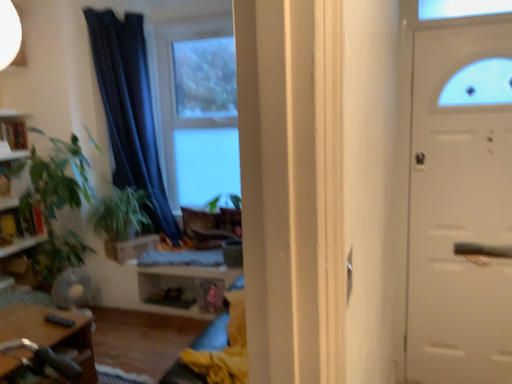
What is the approximate height of dark blue fabric curtain at center?

2.13 meters.

Locate an element on the screen. This screenshot has height=384, width=512. wooden table at lower left is located at coordinates (52, 334).

Locate an element on the screen. This screenshot has height=384, width=512. clear glass window at center is located at coordinates (197, 112).

Where is `wooden bookshelf at left`? wooden bookshelf at left is located at coordinates pyautogui.click(x=12, y=135).

What is the approximate width of wooden bookshelf at left?

9.69 inches.

Identify the location of dark blue fabric curtain at center. This screenshot has width=512, height=384. (130, 110).

From the image's perspective, is clear glass window at center located above or below dark blue fabric curtain at center?

clear glass window at center is situated higher than dark blue fabric curtain at center in the image.

Does clear glass window at center have a smaller size compared to dark blue fabric curtain at center?

Indeed, clear glass window at center has a smaller size compared to dark blue fabric curtain at center.

This screenshot has width=512, height=384. What are the coordinates of `drawer behind the wooden table at lower left` in the screenshot? It's located at (130, 247).

Consider the image. Is brown cardboard drawer at center outside of wooden table at lower left?

Yes, brown cardboard drawer at center is not within wooden table at lower left.

Who is smaller, brown cardboard drawer at center or wooden table at lower left?

Smaller between the two is brown cardboard drawer at center.

Visually, is brown cardboard drawer at center positioned to the left or to the right of wooden table at lower left?

Clearly, brown cardboard drawer at center is on the right of wooden table at lower left in the image.

Measure the distance from dark blue fabric curtain at center to green leafy plant at center.

dark blue fabric curtain at center is 49.90 centimeters away from green leafy plant at center.

Is dark blue fabric curtain at center surrounding green leafy plant at center?

Yes, green leafy plant at center is a part of dark blue fabric curtain at center.

How different are the orientations of dark blue fabric curtain at center and green leafy plant at center in degrees?

dark blue fabric curtain at center and green leafy plant at center are facing 58.8 degrees away from each other.

Would you say dark blue fabric curtain at center is to the left or to the right of green leafy plant at center in the picture?

From the image, it's evident that dark blue fabric curtain at center is to the right of green leafy plant at center.

Is clear glass window at center facing away from green leafy plant at left?

No, clear glass window at center is not facing the opposite direction of green leafy plant at left.

From the picture: Does clear glass window at center have a larger size compared to green leafy plant at left?

Incorrect, clear glass window at center is not larger than green leafy plant at left.

From the picture: In terms of size, does wooden table at lower left appear bigger or smaller than green leafy plant at left?

Considering their sizes, wooden table at lower left takes up less space than green leafy plant at left.

Would you say wooden table at lower left contains green leafy plant at left?

No, wooden table at lower left does not contain green leafy plant at left.

Locate an element on the screen. The height and width of the screenshot is (384, 512). table below the green leafy plant at left (from a real-world perspective) is located at coordinates (52, 334).

Can you confirm if wooden table at lower left is shorter than green leafy plant at left?

Correct, wooden table at lower left is not as tall as green leafy plant at left.

From the image's perspective, which is below, green leafy plant at center or dark blue fabric curtain at center?

green leafy plant at center, from the image's perspective.

Measure the distance between green leafy plant at center and dark blue fabric curtain at center.

green leafy plant at center is 19.64 inches from dark blue fabric curtain at center.

Which is correct: green leafy plant at center is inside dark blue fabric curtain at center, or outside of it?

green leafy plant at center lies within the bounds of dark blue fabric curtain at center.

Which point is more forward, (111, 216) or (141, 178)?

Positioned in front is point (111, 216).

Locate an element on the screen. Image resolution: width=512 pixels, height=384 pixels. table that appears below the dark blue fabric curtain at center (from a real-world perspective) is located at coordinates (52, 334).

Is wooden table at lower left spatially inside dark blue fabric curtain at center, or outside of it?

wooden table at lower left is outside dark blue fabric curtain at center.

Is wooden table at lower left positioned far away from dark blue fabric curtain at center?

Absolutely, wooden table at lower left is distant from dark blue fabric curtain at center.

Between wooden table at lower left and dark blue fabric curtain at center, which one has more height?

dark blue fabric curtain at center is taller.

Locate an element on the screen. The width and height of the screenshot is (512, 384). curtain on the left of clear glass window at center is located at coordinates coord(130,110).

Locate an element on the screen. The image size is (512, 384). drawer behind the wooden table at lower left is located at coordinates (130, 247).

When comparing their distances from dark blue fabric curtain at center, does green leafy plant at center or brown cardboard drawer at center seem further?

brown cardboard drawer at center is positioned further to the anchor dark blue fabric curtain at center.

Which object lies nearer to the anchor point clear glass window at center, green leafy plant at center or wooden bookshelf at left?

Among the two, green leafy plant at center is located nearer to clear glass window at center.

Based on their spatial positions, is dark blue fabric curtain at center or brown cardboard drawer at center further from wooden bookshelf at left?

The object further to wooden bookshelf at left is brown cardboard drawer at center.

Which object lies further to the anchor point clear glass window at center, green leafy plant at center or green leafy plant at left?

green leafy plant at left lies further to clear glass window at center than the other object.

Based on their spatial positions, is green leafy plant at center or clear glass window at center further from brown cardboard drawer at center?

The object further to brown cardboard drawer at center is clear glass window at center.

In the scene shown: Considering their positions, is dark blue fabric curtain at center positioned closer to green leafy plant at left than brown cardboard drawer at center?

brown cardboard drawer at center lies closer to green leafy plant at left than the other object.

From the image, which object appears to be nearer to clear glass window at center, wooden table at lower left or dark blue fabric curtain at center?

dark blue fabric curtain at center is closer to clear glass window at center.

When comparing their distances from green leafy plant at center, does wooden bookshelf at left or clear glass window at center seem closer?

clear glass window at center.

Where is `drawer between wooden bookshelf at left and clear glass window at center from left to right`? Image resolution: width=512 pixels, height=384 pixels. drawer between wooden bookshelf at left and clear glass window at center from left to right is located at coordinates (130, 247).

Find the location of `houseplant between dark blue fabric curtain at center and brown cardboard drawer at center from top to bottom`. houseplant between dark blue fabric curtain at center and brown cardboard drawer at center from top to bottom is located at coordinates (57, 205).

At what (x,y) coordinates should I click in order to perform the action: click on plant between wooden table at lower left and clear glass window at center in the front-back direction. Please return your answer as a coordinate pair (x, y). Image resolution: width=512 pixels, height=384 pixels. Looking at the image, I should click on (121, 214).

You are a GUI agent. You are given a task and a screenshot of the screen. Output one action in this format:
    pyautogui.click(x=<x>, y=<y>)
    Task: Click on the houseplant between wooden bookshelf at left and green leafy plant at center in the horizontal direction
    The width and height of the screenshot is (512, 384).
    Given the screenshot: What is the action you would take?
    pyautogui.click(x=57, y=205)